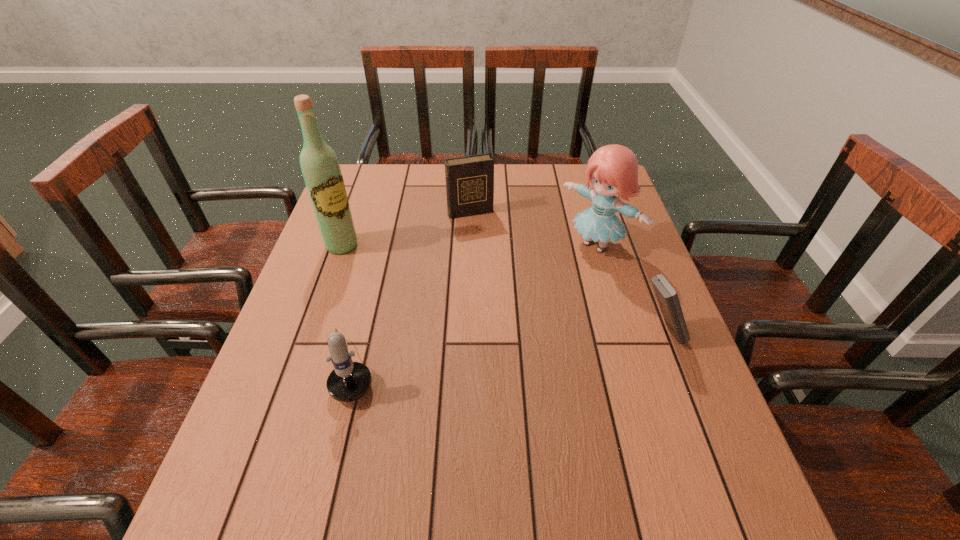
The image size is (960, 540). Find the location of `free space on the desktop that is between the fourth object from right to left and the calculator and is positioned on the front-facing side of the wine bottle`. free space on the desktop that is between the fourth object from right to left and the calculator and is positioned on the front-facing side of the wine bottle is located at coordinates (474, 353).

At what (x,y) coordinates should I click in order to perform the action: click on free space on the desktop that is between the microphone and the calculator and is positioned on the front cover of the farthest object. Please return your answer as a coordinate pair (x, y). This screenshot has height=540, width=960. Looking at the image, I should click on (531, 347).

You are a GUI agent. You are given a task and a screenshot of the screen. Output one action in this format:
    pyautogui.click(x=<x>, y=<y>)
    Task: Click on the free space on the desktop that is between the microphone and the calculator and is positioned on the front-facing side of the doll
    
    Given the screenshot: What is the action you would take?
    pyautogui.click(x=468, y=353)